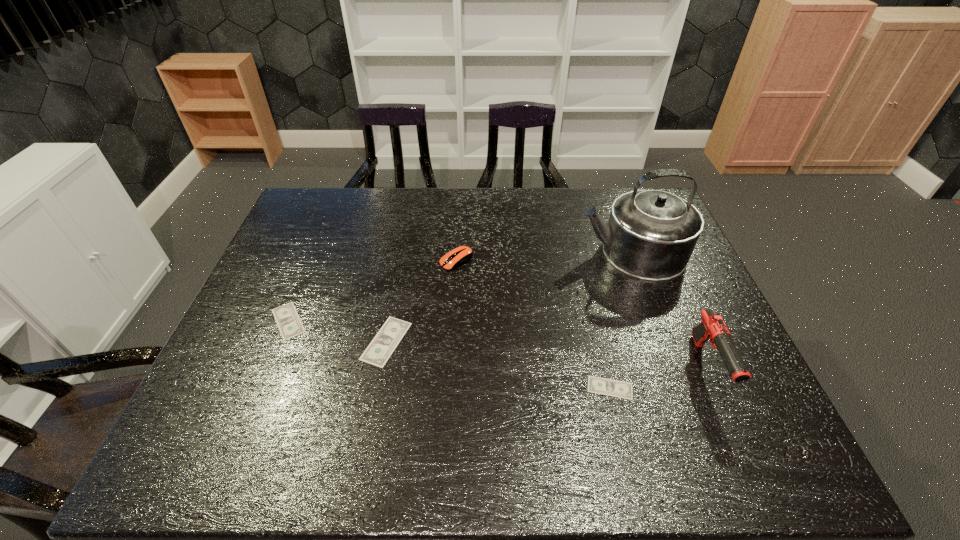
Find the location of a particular element. free space for an extra money to achieve even spacing is located at coordinates (493, 363).